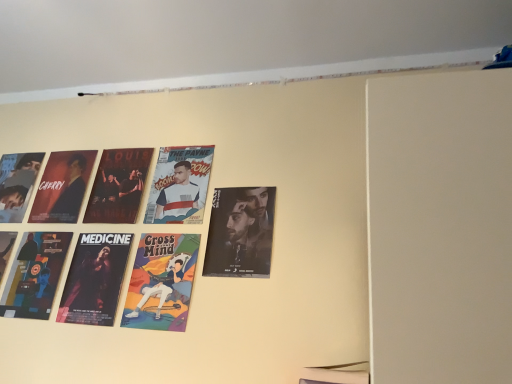
What do you see at coordinates (71, 191) in the screenshot? This screenshot has width=512, height=384. I see `matte black poster at left, the third person positioned from the right` at bounding box center [71, 191].

What is the approximate height of matte black poster at left, the third person positioned from the right?

It is 12.03 inches.

This screenshot has height=384, width=512. I want to click on matte black poster at center left, which ranks as the second poster in left-to-right order, so (95, 279).

I want to click on matte black poster at left, the first person viewed from the left, so click(x=71, y=191).

Would you say cartoon character poster at center, which appears as the 2th person when viewed from the left, contains matte black poster at center, the 3th poster from the left?

No.

Identify the location of person that is in front of the matte black poster at center, the 3th poster from the left. The height and width of the screenshot is (384, 512). (160, 290).

In the scene shown: Does cartoon character poster at center, the second person from the right, touch matte black poster at center, acting as the first poster starting from the right?

No, cartoon character poster at center, the second person from the right, is not beside matte black poster at center, acting as the first poster starting from the right.

Is cartoon character poster at center, the second person from the right, positioned with its back to matte black poster at center, acting as the first poster starting from the right?

No, cartoon character poster at center, the second person from the right,'s orientation is not away from matte black poster at center, acting as the first poster starting from the right.

From a real-world perspective, between cartoon character poster at center, which appears as the 2th person when viewed from the left, and matte black poster at left, the first person viewed from the left, who is vertically lower?

cartoon character poster at center, which appears as the 2th person when viewed from the left.

Is cartoon character poster at center, which appears as the 2th person when viewed from the left, not inside matte black poster at left, the third person positioned from the right?

That's correct, cartoon character poster at center, which appears as the 2th person when viewed from the left, is outside of matte black poster at left, the third person positioned from the right.

Which is in front, cartoon character poster at center, the second person from the right, or matte black poster at left, the third person positioned from the right?

cartoon character poster at center, the second person from the right.

Would you say matte black poster at center left, which ranks as the second poster in left-to-right order, is to the left or to the right of matte black poster at lower left, which appears as the first poster when viewed from the left, in the picture?

matte black poster at center left, which ranks as the second poster in left-to-right order, is to the right of matte black poster at lower left, which appears as the first poster when viewed from the left.

Does matte black poster at center left, which ranks as the second poster in left-to-right order, turn towards matte black poster at lower left, marked as the 3th poster in a right-to-left arrangement?

No, matte black poster at center left, which ranks as the second poster in left-to-right order, is not turned towards matte black poster at lower left, marked as the 3th poster in a right-to-left arrangement.

Considering the points (71, 287) and (6, 248), which point is behind, point (71, 287) or point (6, 248)?

The point (6, 248) is farther from the camera.

Looking at this image, in terms of size, does matte black poster at center left, marked as the second poster in a right-to-left arrangement, appear bigger or smaller than matte black poster at lower left, marked as the 3th poster in a right-to-left arrangement?

In the image, matte black poster at center left, marked as the second poster in a right-to-left arrangement, appears to be smaller than matte black poster at lower left, marked as the 3th poster in a right-to-left arrangement.

Can you tell me how much matte black poster at center left, marked as the second poster in a right-to-left arrangement, and matte black poster at left, the first person viewed from the left, differ in facing direction?

They differ by 1.49 degrees in their facing directions.

Which object is thinner, matte black poster at center left, marked as the second poster in a right-to-left arrangement, or matte black poster at left, the third person positioned from the right?

With smaller width is matte black poster at center left, marked as the second poster in a right-to-left arrangement.

Measure the distance between matte black poster at center left, marked as the second poster in a right-to-left arrangement, and matte black poster at left, the first person viewed from the left.

matte black poster at center left, marked as the second poster in a right-to-left arrangement, and matte black poster at left, the first person viewed from the left, are 9.19 inches apart from each other.

Find the location of `poster that is the 2nd object located below the matte black poster at left, the first person viewed from the left (from the image's perspective)`. poster that is the 2nd object located below the matte black poster at left, the first person viewed from the left (from the image's perspective) is located at coordinates (95, 279).

Is cartoon character poster at center, the second person from the right, facing towards matte black poster at center left, marked as the second poster in a right-to-left arrangement?

No, cartoon character poster at center, the second person from the right, does not turn towards matte black poster at center left, marked as the second poster in a right-to-left arrangement.

In the image, is cartoon character poster at center, which appears as the 2th person when viewed from the left, on the left side or the right side of matte black poster at center left, which ranks as the second poster in left-to-right order?

In the image, cartoon character poster at center, which appears as the 2th person when viewed from the left, appears on the right side of matte black poster at center left, which ranks as the second poster in left-to-right order.

Looking at their sizes, would you say cartoon character poster at center, the second person from the right, is wider or thinner than matte black poster at center left, which ranks as the second poster in left-to-right order?

Clearly, cartoon character poster at center, the second person from the right, has less width compared to matte black poster at center left, which ranks as the second poster in left-to-right order.

How many degrees apart are the facing directions of cartoon character poster at center, the second person from the right, and matte black poster at center left, which ranks as the second poster in left-to-right order?

The angular difference between cartoon character poster at center, the second person from the right, and matte black poster at center left, which ranks as the second poster in left-to-right order, is 0.00122 degrees.

This screenshot has width=512, height=384. I want to click on the 2nd person counting from the left side of the matte black poster at center, acting as the first poster starting from the right, so click(x=160, y=290).

Could you tell me if matte black poster at center, the 3th poster from the left, is turned towards cartoon character poster at center, which appears as the 2th person when viewed from the left?

No, matte black poster at center, the 3th poster from the left, does not turn towards cartoon character poster at center, which appears as the 2th person when viewed from the left.

Is matte black poster at center, acting as the first poster starting from the right, inside the boundaries of cartoon character poster at center, the second person from the right, or outside?

matte black poster at center, acting as the first poster starting from the right, is outside cartoon character poster at center, the second person from the right.

In the image, is matte black poster at center, acting as the first poster starting from the right, positioned in front of or behind cartoon character poster at center, which appears as the 2th person when viewed from the left?

matte black poster at center, acting as the first poster starting from the right, is behind cartoon character poster at center, which appears as the 2th person when viewed from the left.

Is the position of matte black poster at lower left, marked as the 3th poster in a right-to-left arrangement, more distant than that of white glossy poster at center, the third person in the left-to-right sequence?

Yes, matte black poster at lower left, marked as the 3th poster in a right-to-left arrangement, is behind white glossy poster at center, the third person in the left-to-right sequence.

Is point (2, 233) farther from camera compared to point (194, 193)?

Yes.

Does matte black poster at lower left, which appears as the first poster when viewed from the left, have a greater height compared to white glossy poster at center, the 1th person viewed from the right?

Indeed, matte black poster at lower left, which appears as the first poster when viewed from the left, has a greater height compared to white glossy poster at center, the 1th person viewed from the right.

Where is `poster to the right of cartoon character poster at center, the second person from the right`? poster to the right of cartoon character poster at center, the second person from the right is located at coordinates (240, 232).

From the image's perspective, count 1st persons upward from the cartoon character poster at center, which appears as the 2th person when viewed from the left, and point to it. Please provide its 2D coordinates.

[(71, 191)]

Based on their spatial positions, is matte black poster at center, acting as the first poster starting from the right, or matte black poster at center left, which ranks as the second poster in left-to-right order, closer to matte black poster at left, the first person viewed from the left?

The object closer to matte black poster at left, the first person viewed from the left, is matte black poster at center left, which ranks as the second poster in left-to-right order.

Which object lies further to the anchor point matte black poster at lower left, which appears as the first poster when viewed from the left, cartoon character poster at center, which appears as the 2th person when viewed from the left, or white glossy poster at center, the 1th person viewed from the right?

white glossy poster at center, the 1th person viewed from the right.

Considering their positions, is matte black poster at lower left, which appears as the first poster when viewed from the left, positioned closer to matte black poster at center, the 3th poster from the left, than white glossy poster at center, the 1th person viewed from the right?

white glossy poster at center, the 1th person viewed from the right, is closer to matte black poster at center, the 3th poster from the left.

From the image, which object appears to be nearer to matte black poster at lower left, marked as the 3th poster in a right-to-left arrangement, cartoon character poster at center, which appears as the 2th person when viewed from the left, or matte black poster at center left, which ranks as the second poster in left-to-right order?

The object closer to matte black poster at lower left, marked as the 3th poster in a right-to-left arrangement, is matte black poster at center left, which ranks as the second poster in left-to-right order.

When comparing their distances from matte black poster at center, the 3th poster from the left, does white glossy poster at center, the 1th person viewed from the right, or matte black poster at center left, which ranks as the second poster in left-to-right order, seem closer?

Based on the image, white glossy poster at center, the 1th person viewed from the right, appears to be nearer to matte black poster at center, the 3th poster from the left.

When comparing their distances from matte black poster at center left, which ranks as the second poster in left-to-right order, does cartoon character poster at center, which appears as the 2th person when viewed from the left, or white glossy poster at center, the 1th person viewed from the right, seem closer?

Based on the image, cartoon character poster at center, which appears as the 2th person when viewed from the left, appears to be nearer to matte black poster at center left, which ranks as the second poster in left-to-right order.

When comparing their distances from matte black poster at center left, marked as the second poster in a right-to-left arrangement, does matte black poster at center, acting as the first poster starting from the right, or cartoon character poster at center, the second person from the right, seem further?

Among the two, matte black poster at center, acting as the first poster starting from the right, is located further to matte black poster at center left, marked as the second poster in a right-to-left arrangement.

Looking at the image, which one is located further to matte black poster at left, the first person viewed from the left, cartoon character poster at center, the second person from the right, or white glossy poster at center, the 1th person viewed from the right?

cartoon character poster at center, the second person from the right.

Locate an element on the screen. This screenshot has height=384, width=512. poster between matte black poster at lower left, which appears as the first poster when viewed from the left, and white glossy poster at center, the third person in the left-to-right sequence, from left to right is located at coordinates pyautogui.click(x=95, y=279).

At what (x,y) coordinates should I click in order to perform the action: click on poster located between matte black poster at left, the third person positioned from the right, and matte black poster at center, the 3th poster from the left, in the left-right direction. Please return your answer as a coordinate pair (x, y). The image size is (512, 384). Looking at the image, I should click on (95, 279).

At what (x,y) coordinates should I click in order to perform the action: click on person between matte black poster at lower left, marked as the 3th poster in a right-to-left arrangement, and cartoon character poster at center, which appears as the 2th person when viewed from the left, in the horizontal direction. Please return your answer as a coordinate pair (x, y). Looking at the image, I should click on (71, 191).

Find the location of `poster between matte black poster at lower left, which appears as the first poster when viewed from the left, and cartoon character poster at center, the second person from the right`. poster between matte black poster at lower left, which appears as the first poster when viewed from the left, and cartoon character poster at center, the second person from the right is located at coordinates (95, 279).